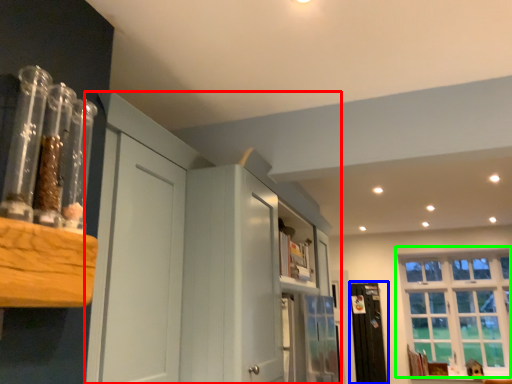
Question: Which object is the farthest from dresser (highlighted by a red box)? Choose among these: screen door (highlighted by a blue box) or window (highlighted by a green box).

Choices:
 (A) screen door
 (B) window

Answer: (B)